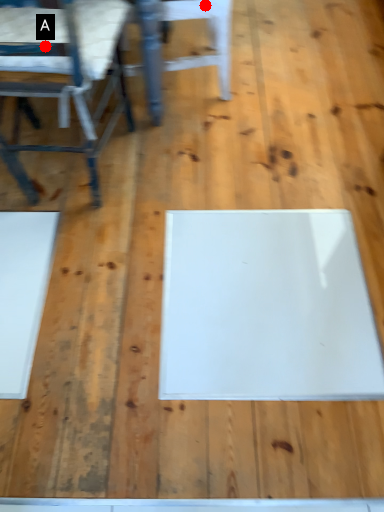
Question: Two points are circled on the image, labeled by A and B beside each circle. Which point is farther from the camera taking this photo?

Choices:
 (A) A is further
 (B) B is further

Answer: (B)